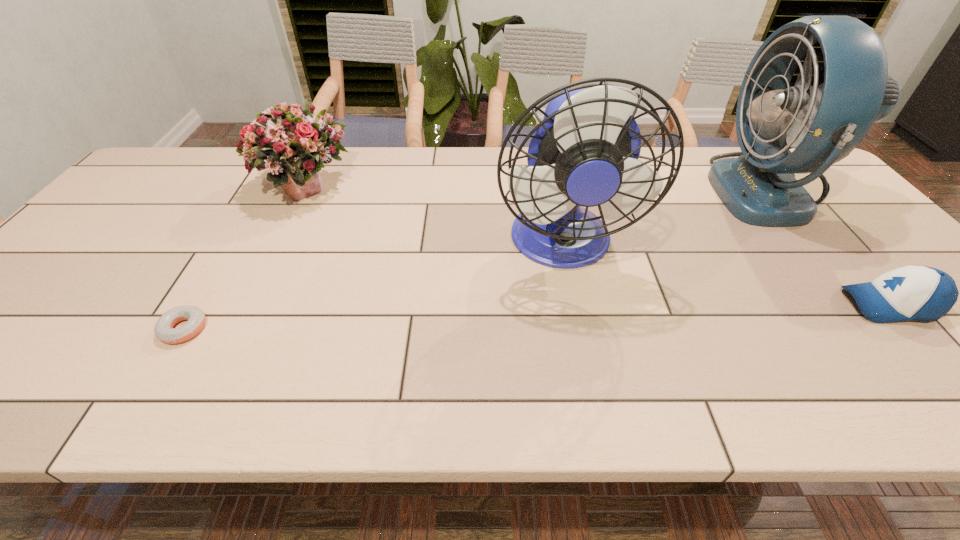
This screenshot has height=540, width=960. In order to click on free space between the right fan and the shortest object in this screenshot , I will do `click(476, 260)`.

Point out which object is positioned as the fourth nearest to the doughnut. Please provide its 2D coordinates. Your answer should be formatted as a tuple, i.e. [(x, y)], where the tuple contains the x and y coordinates of a point satisfying the conditions above.

[(913, 292)]

What are the coordinates of `object that ranks as the fourth closest to the bouquet` in the screenshot? It's located at (913, 292).

Identify the location of vacant area that satisfies the following two spatial constraints: 1. on the back side of the shortest object; 2. on the right side of the third tallest object. (267, 190).

Where is `vacant region that satisfies the following two spatial constraints: 1. on the front-facing side of the fourth tallest object; 2. on the front side of the doughnut`? The image size is (960, 540). vacant region that satisfies the following two spatial constraints: 1. on the front-facing side of the fourth tallest object; 2. on the front side of the doughnut is located at coordinates tap(910, 329).